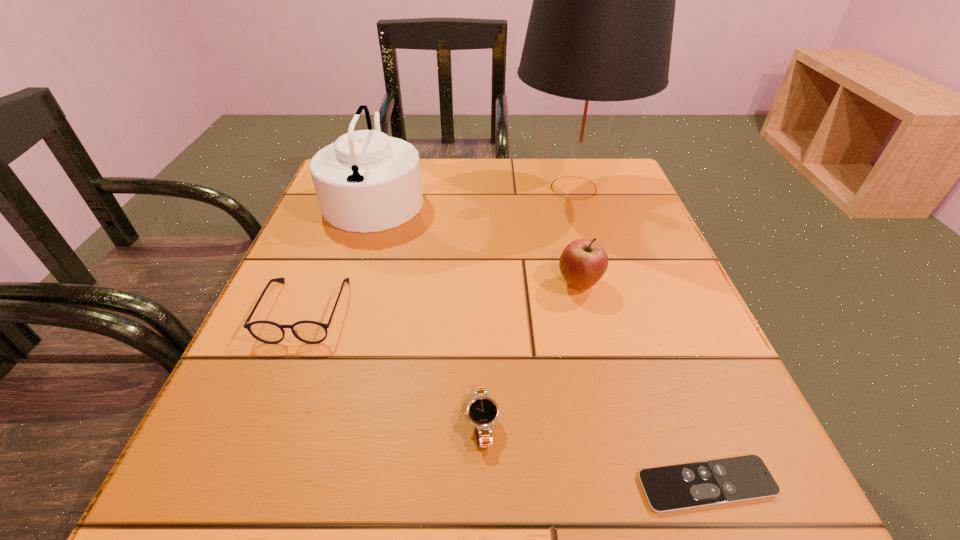
The height and width of the screenshot is (540, 960). I want to click on object that stands as the closest to the second tallest object, so click(x=311, y=332).

Image resolution: width=960 pixels, height=540 pixels. What are the coordinates of `object identified as the fourth closest to the fifth farthest object` in the screenshot? It's located at (366, 181).

You are a GUI agent. You are given a task and a screenshot of the screen. Output one action in this format:
    pyautogui.click(x=<x>, y=<y>)
    Task: Click on the free space that satisfies the following two spatial constraints: 1. on the back side of the tallest object; 2. on the left side of the apple
    The width and height of the screenshot is (960, 540).
    Given the screenshot: What is the action you would take?
    pyautogui.click(x=556, y=187)

Locate an element on the screen. blank space that satisfies the following two spatial constraints: 1. on the back side of the apple; 2. on the left side of the tallest object is located at coordinates (556, 187).

Locate an element on the screen. The image size is (960, 540). vacant position in the image that satisfies the following two spatial constraints: 1. on the front-facing side of the third shortest object; 2. on the left side of the fifth tallest object is located at coordinates (260, 423).

Where is `vacant region that satisfies the following two spatial constraints: 1. on the spout of the fifth shortest object; 2. on the front-facing side of the third shortest object`? The image size is (960, 540). vacant region that satisfies the following two spatial constraints: 1. on the spout of the fifth shortest object; 2. on the front-facing side of the third shortest object is located at coordinates (339, 310).

In order to click on free location that satisfies the following two spatial constraints: 1. on the spout of the kettle; 2. on the front-facing side of the spectacles in this screenshot , I will do `click(339, 310)`.